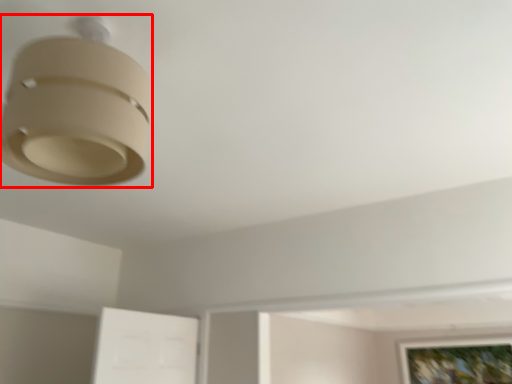
Question: From the image's perspective, where is lamp (annotated by the red box) located in relation to picture frame in the image?

Choices:
 (A) below
 (B) above

Answer: (B)